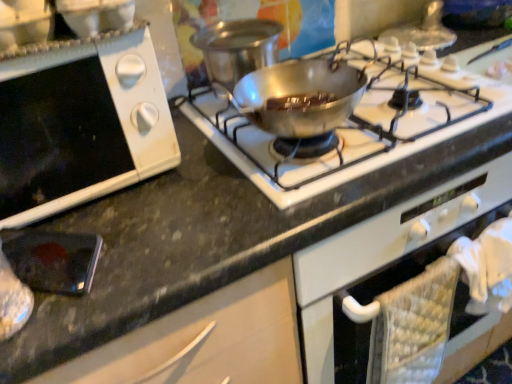
Identify the location of vacant area that is in front of white matte oven at lower left. The height and width of the screenshot is (384, 512). (137, 256).